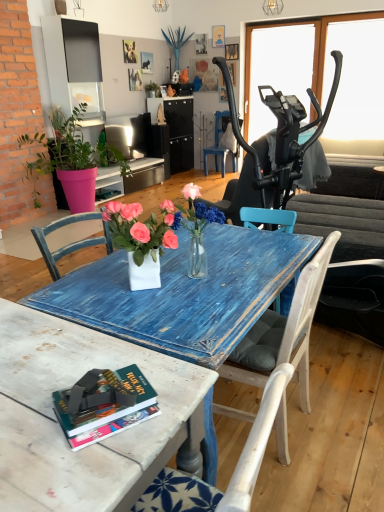
Find the location of a particular element. This screenshot has height=512, width=384. vacant space situated on the left part of hardcover book at lower left is located at coordinates (32, 408).